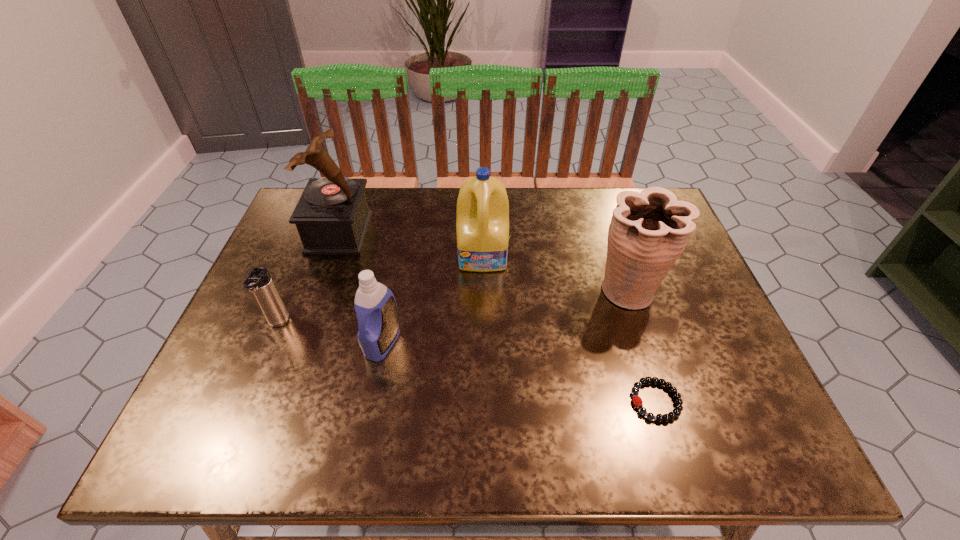
Find the location of a particular element. bracelet that is at the right edge is located at coordinates (676, 412).

I want to click on object that is positioned at the far left corner, so click(332, 216).

This screenshot has height=540, width=960. Identify the location of object that is at the near right corner. (676, 412).

At what (x,y) coordinates should I click in order to perform the action: click on free region at the far edge of the desktop. Please return your answer as a coordinate pair (x, y). Looking at the image, I should click on (387, 195).

The height and width of the screenshot is (540, 960). In the image, there is a desktop. In order to click on vacant region at the left edge in this screenshot , I will do `click(278, 384)`.

In the image, there is a desktop. Where is `free region at the right edge`? The image size is (960, 540). free region at the right edge is located at coordinates (706, 345).

Where is `vacant space at the near left corner`? vacant space at the near left corner is located at coordinates (207, 428).

Image resolution: width=960 pixels, height=540 pixels. In the image, there is a desktop. Find the location of `free space at the near right corner`. free space at the near right corner is located at coordinates (725, 449).

Locate an element on the screen. empty space that is in between the bracelet and the right detergent is located at coordinates (569, 328).

Where is `free space between the bracelet and the shorter detergent`? free space between the bracelet and the shorter detergent is located at coordinates (519, 372).